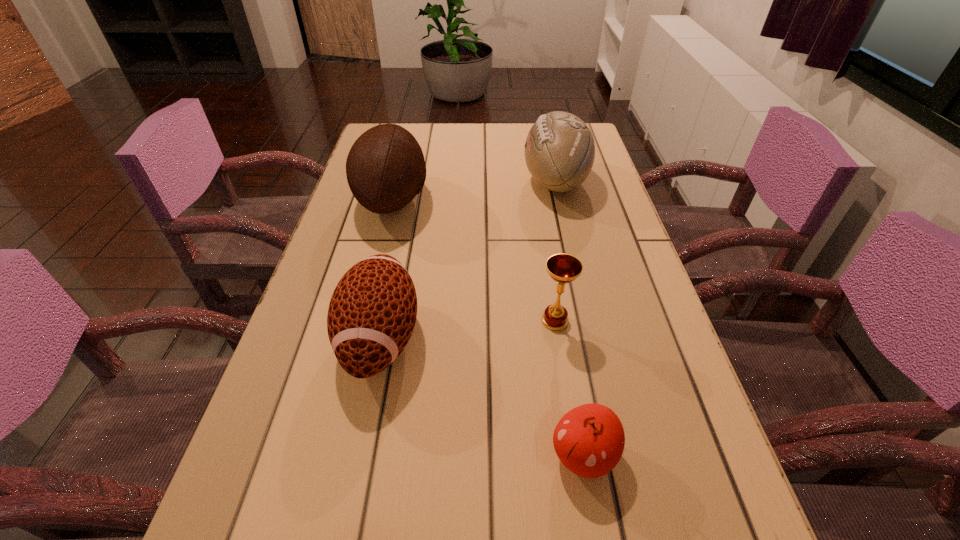
Point out which object is positioned as the fourth nearest to the shortest football. Please provide its 2D coordinates. Your answer should be formatted as a tuple, i.e. [(x, y)], where the tuple contains the x and y coordinates of a point satisfying the conditions above.

[(559, 151)]

Identify the location of object that is the closest to the shortest football. (385, 168).

Locate which football ranks in proximity to the chalice. Please provide its 2D coordinates. Your answer should be formatted as a tuple, i.e. [(x, y)], where the tuple contains the x and y coordinates of a point satisfying the conditions above.

[(372, 313)]

Point out which football is positioned as the second nearest to the rightmost football. Please provide its 2D coordinates. Your answer should be formatted as a tuple, i.e. [(x, y)], where the tuple contains the x and y coordinates of a point satisfying the conditions above.

[(372, 313)]